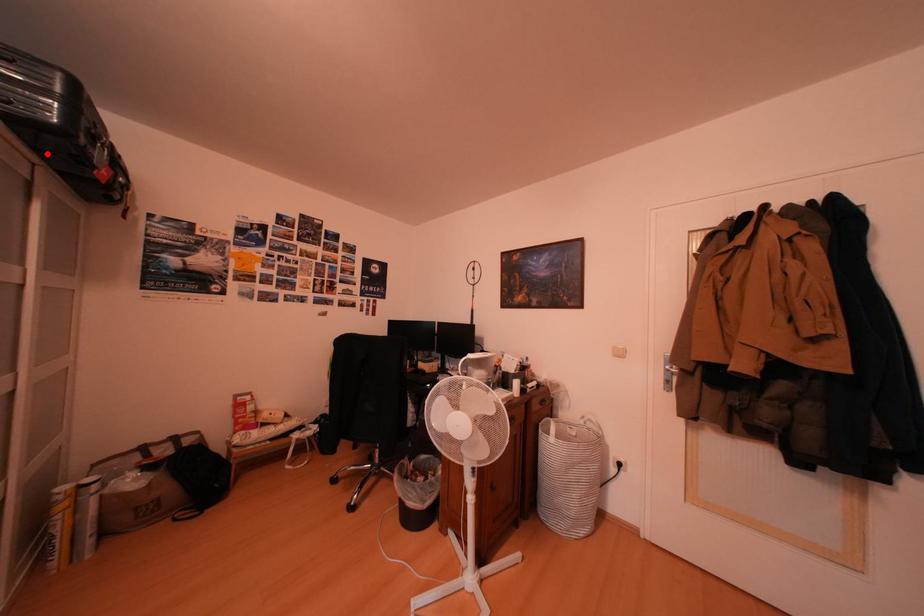
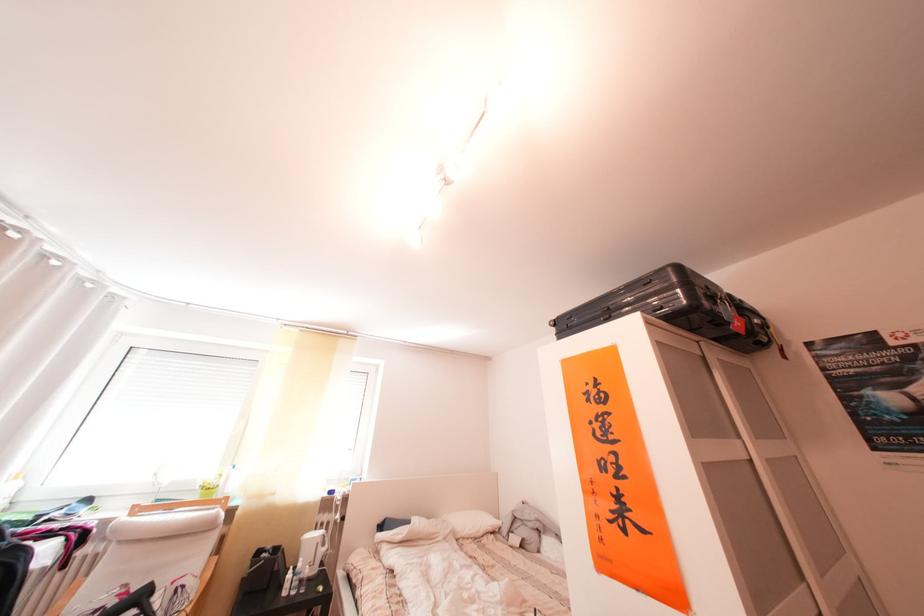
In the second image, find the point that corresponds to the highlighted location in the first image.

(703, 336)